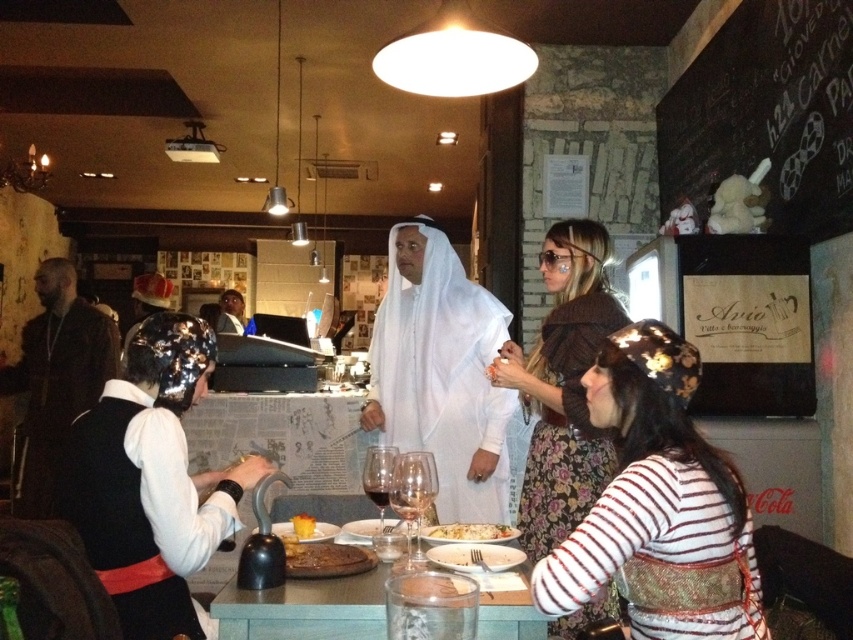
You are a customer at this restaurant and want to place your phone on either the dark brown leather jacket at left or the yellow cake at center. Which surface is more suitable for placing your phone?

The dark brown leather jacket at left is taller than the yellow cake at center, so placing the phone on the dark brown leather jacket at left would provide a more stable and elevated surface compared to the yellow cake at center.

You are standing at the point labeled point (300,518) in the image. You want to move to the point labeled point (33,481). Which direction should you move to reach your destination?

To move from point (300,518) to point (33,481), you should move downward and to the left since point (33,481) is behind point (300,518).